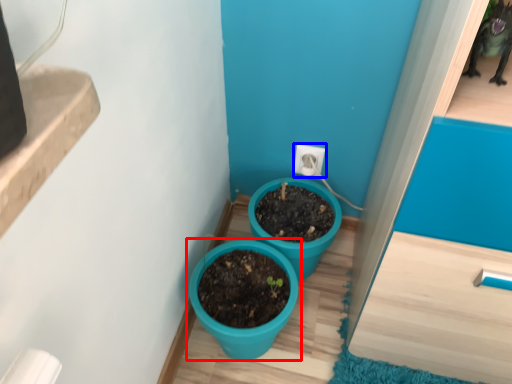
Question: Among these objects, which one is farthest to the camera, flowerpot (highlighted by a red box) or electric outlet (highlighted by a blue box)?

Choices:
 (A) flowerpot
 (B) electric outlet

Answer: (B)